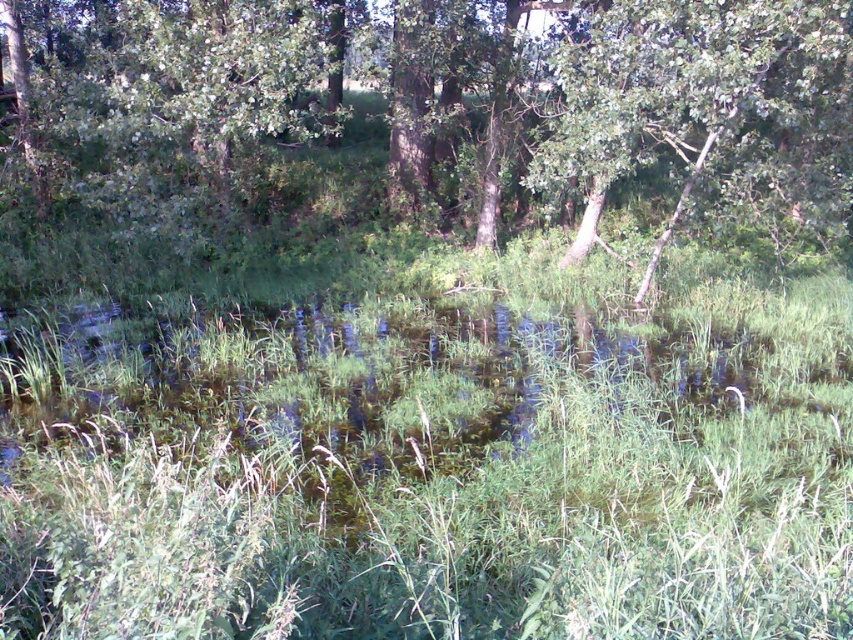
Question: Is green leafy tree at center below green leafy tree at upper center?

Choices:
 (A) yes
 (B) no

Answer: (B)

Question: Among these points, which one is farthest from the camera?

Choices:
 (A) (9, 76)
 (B) (697, 20)

Answer: (A)

Question: Is green leafy tree at center to the left of green leafy tree at upper center from the viewer's perspective?

Choices:
 (A) yes
 (B) no

Answer: (A)

Question: Is green leafy tree at center to the left of green leafy tree at upper center from the viewer's perspective?

Choices:
 (A) no
 (B) yes

Answer: (B)

Question: Which of the following is the farthest from the observer?

Choices:
 (A) green leafy tree at upper center
 (B) green leafy tree at center

Answer: (B)